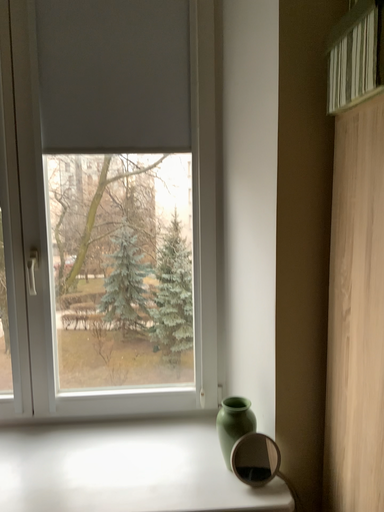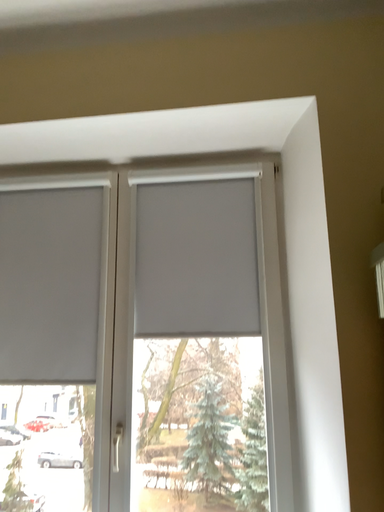
Question: How did the camera likely rotate when shooting the video?

Choices:
 (A) rotated upward
 (B) rotated downward

Answer: (A)